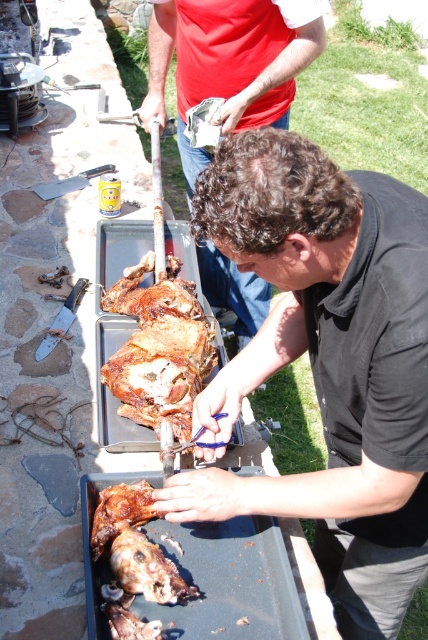
Based on the photo, is black matte/softperson at center shorter than brown crispy skin at center?

Incorrect, black matte/softperson at center's height does not fall short of brown crispy skin at center's.

Does black matte/softperson at center appear under brown crispy skin at center?

Yes, black matte/softperson at center is below brown crispy skin at center.

Is point (306, 298) farther from viewer compared to point (107, 380)?

No, it is in front of (107, 380).

What are the coordinates of `black matte/softperson at center` in the screenshot? It's located at (326, 362).

Which of these two, black matte/softperson at center or matte brown meat at center, stands taller?

black matte/softperson at center is taller.

Who is more distant from viewer, (308, 506) or (178, 131)?

Point (178, 131)

Locate an element on the screen. black matte/softperson at center is located at coordinates (326, 362).

Find the location of a particular element. The image size is (428, 640). black matte/softperson at center is located at coordinates (326, 362).

Who is more distant from viewer, (276, 10) or (139, 401)?

The point (276, 10) is behind.

Can you confirm if matte brown meat at center is bigger than brown crispy skin at center?

Yes.

Who is more distant from viewer, (296, 54) or (166, 417)?

The point (296, 54) is more distant.

Locate an element on the screen. The width and height of the screenshot is (428, 640). matte brown meat at center is located at coordinates (229, 61).